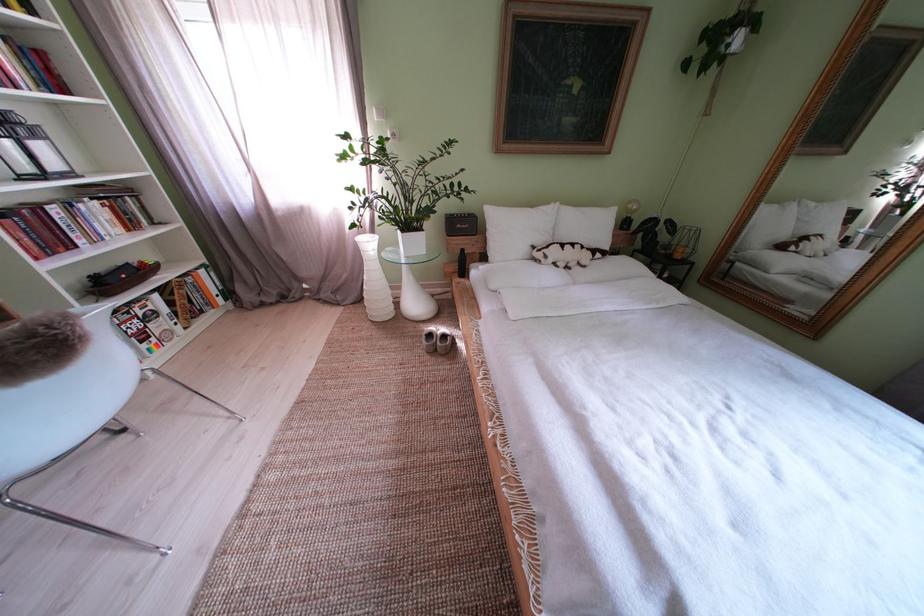
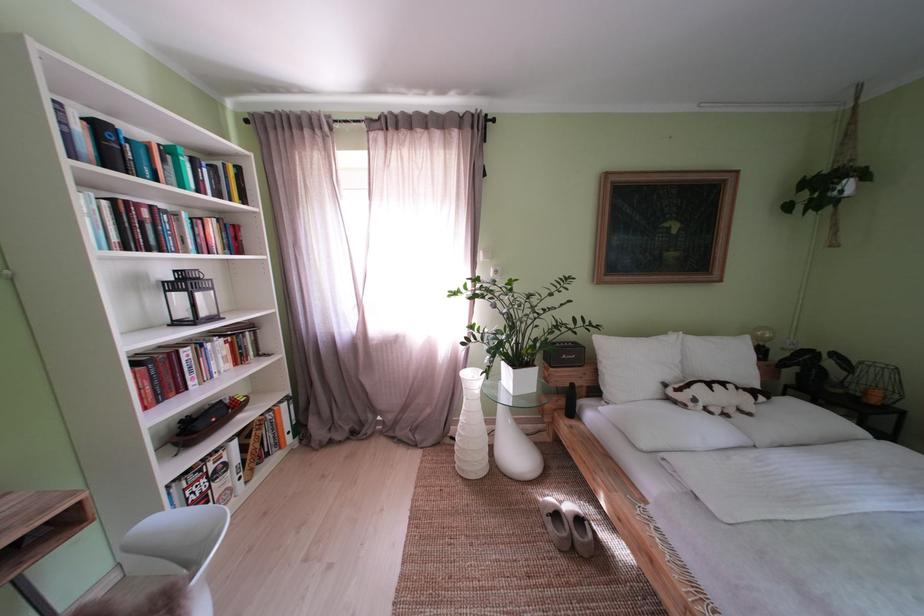
Locate, in the second image, the point that corresponds to pixel 594 215 in the first image.

(723, 344)